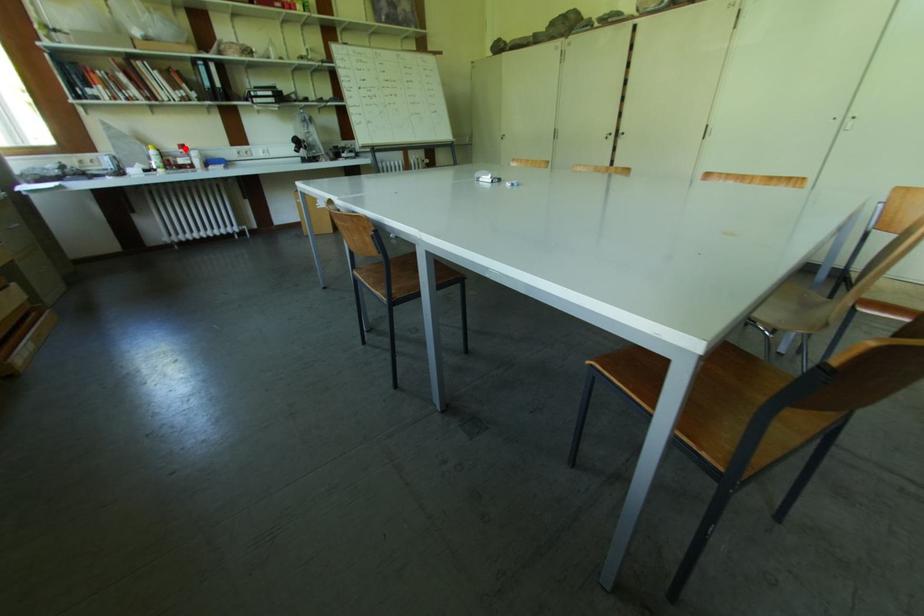
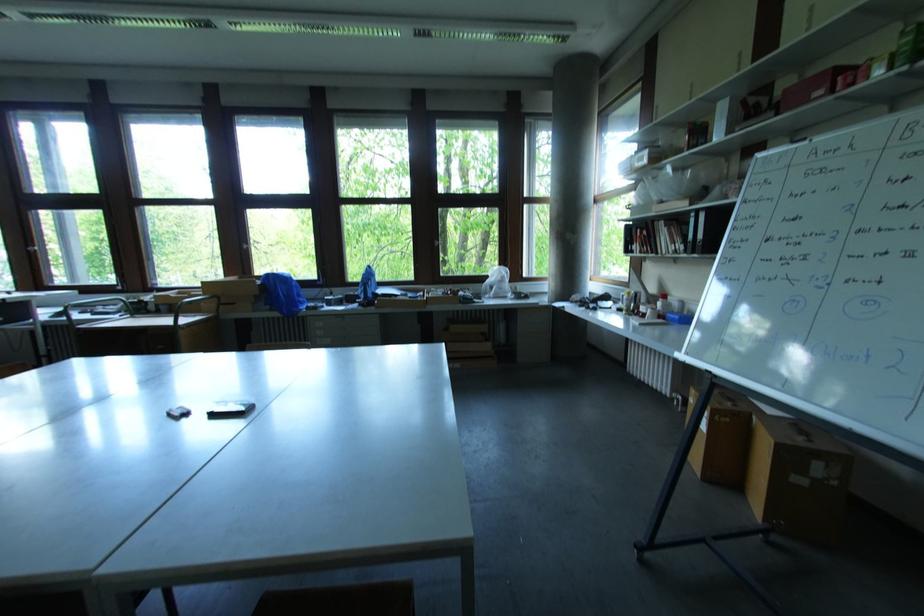
The point at the highlighted location is marked in the first image. Where is the corresponding point in the second image?

(667, 298)